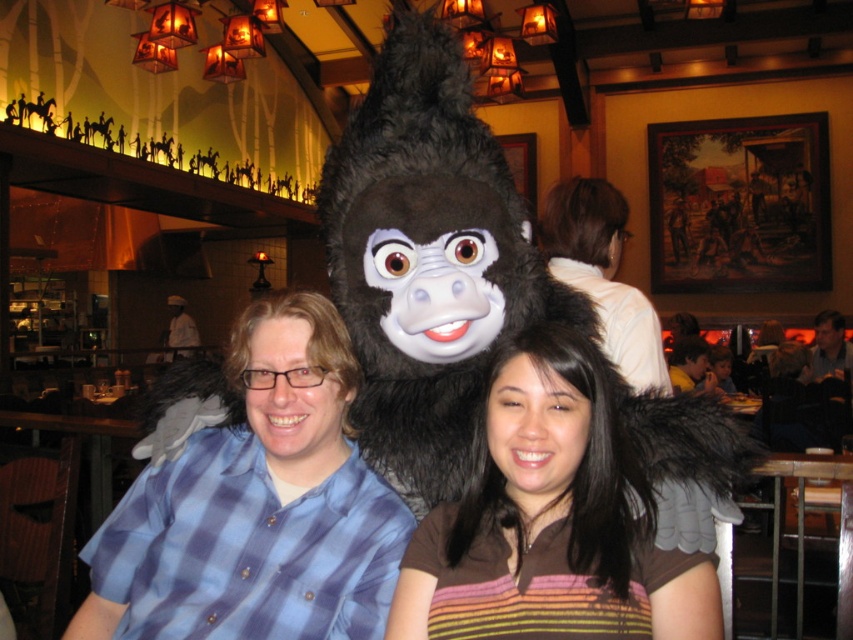
You are standing in the restaurant and want to take a photo of the white shirt at upper center without any obstructions. Given that you are currently 4.87 feet away from it, is there enough space to move closer to get a clearer shot?

The white shirt at upper center is exactly 4.87 feet away from you. Since you want to move closer, you need to adjust your position to reduce the distance. However, the description only specifies the current distance and does not mention any obstacles. Assuming there are no obstructions, you can move closer than 4.87 feet to take the photo.

You are a photographer setting up for an event. You notice the white shirt at upper center and the smooth brown hair at center in your frame. Based on their positions, which object should you adjust your camera to focus on first if you want to ensure both are in the frame without moving the camera? Explain your reasoning.

The white shirt at upper center is to the left of the smooth brown hair at center. To include both in the frame without moving the camera, focus on the white shirt at upper center first since it is positioned further left, ensuring the camera captures its leftmost edge before adjusting to include the right side where the smooth brown hair at center is located.

You are a photographer at this event and want to take a photo of the brown striped shirt at center and fuzzy black gorilla at center. Which one is closer to the camera?

The fuzzy black gorilla at center is closer to the camera than the brown striped shirt at center because the brown striped shirt at center is behind the fuzzy black gorilla at center.